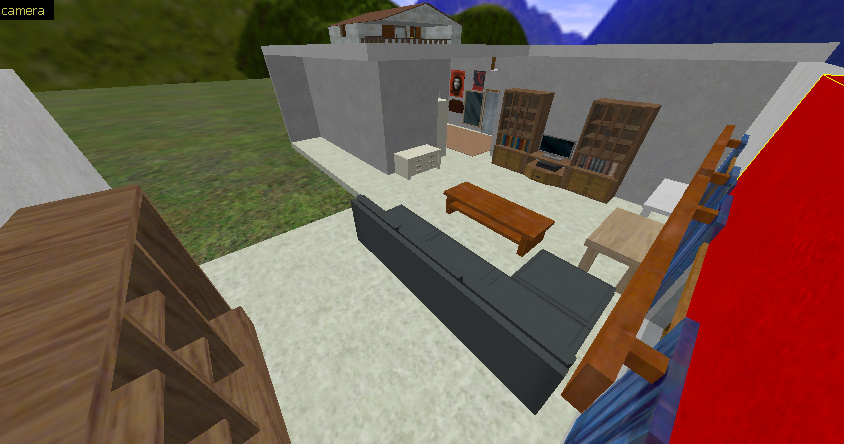
Locate an element on the screen. wall is located at coordinates (619, 80).